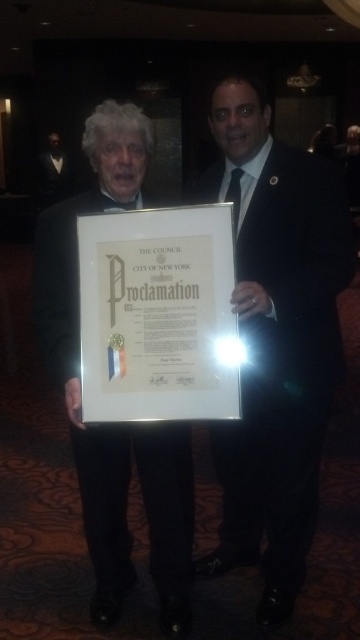
Question: Which of the following is the closest to the observer?

Choices:
 (A) white paper at center
 (B) black suit at center

Answer: (A)

Question: Can you confirm if black suit at center is positioned below white paper at center?

Choices:
 (A) yes
 (B) no

Answer: (A)

Question: Is black suit at center positioned at the back of white paper at center?

Choices:
 (A) no
 (B) yes

Answer: (B)

Question: Is black suit at center wider than white paper at center?

Choices:
 (A) yes
 (B) no

Answer: (A)